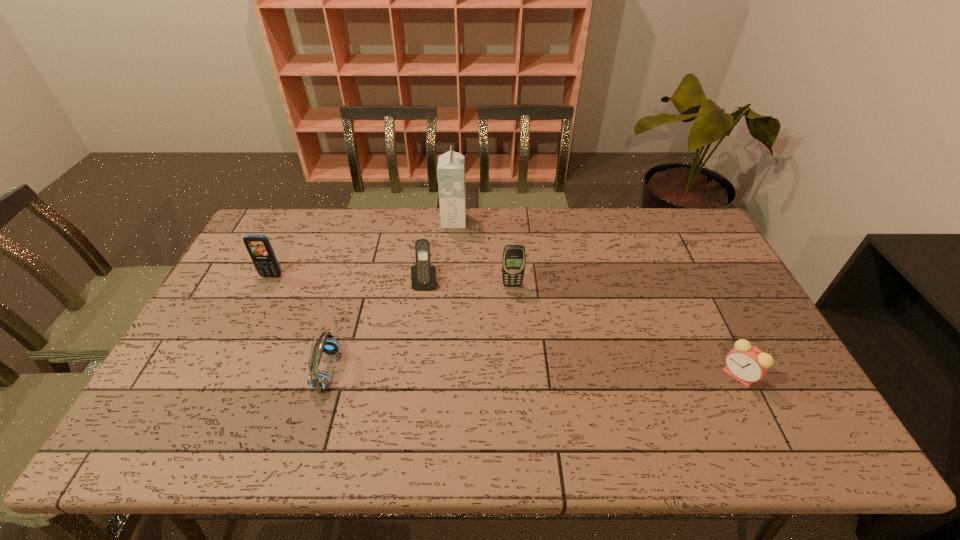
Identify the location of the tallest object. (451, 165).

Find the location of a particular element. This screenshot has width=960, height=540. the farthest object is located at coordinates (451, 165).

Where is `the leftmost cellular telephone`? the leftmost cellular telephone is located at coordinates (259, 248).

Locate an element on the screen. the second object from right to left is located at coordinates (513, 261).

You are a GUI agent. You are given a task and a screenshot of the screen. Output one action in this format:
    pyautogui.click(x=<x>, y=<y>)
    Task: Click on the second cellular telephone from right to left
    The image size is (960, 540).
    Given the screenshot: What is the action you would take?
    pyautogui.click(x=423, y=275)

Find the location of a particular element. This screenshot has height=540, width=960. alarm clock is located at coordinates (747, 364).

You are a GUI agent. You are given a task and a screenshot of the screen. Output one action in this format:
    pyautogui.click(x=<x>, y=<y>)
    Task: Click on the second object from left to right
    
    Given the screenshot: What is the action you would take?
    pyautogui.click(x=326, y=343)

Identify the location of vacant space located 0.060m on the front label of the farthest object. (482, 221).

The image size is (960, 540). In order to click on free space located on the screen of the leftmost object in this screenshot , I will do `click(258, 305)`.

This screenshot has width=960, height=540. Identify the location of vacant space located 0.140m on the screen of the second object from right to left. (515, 322).